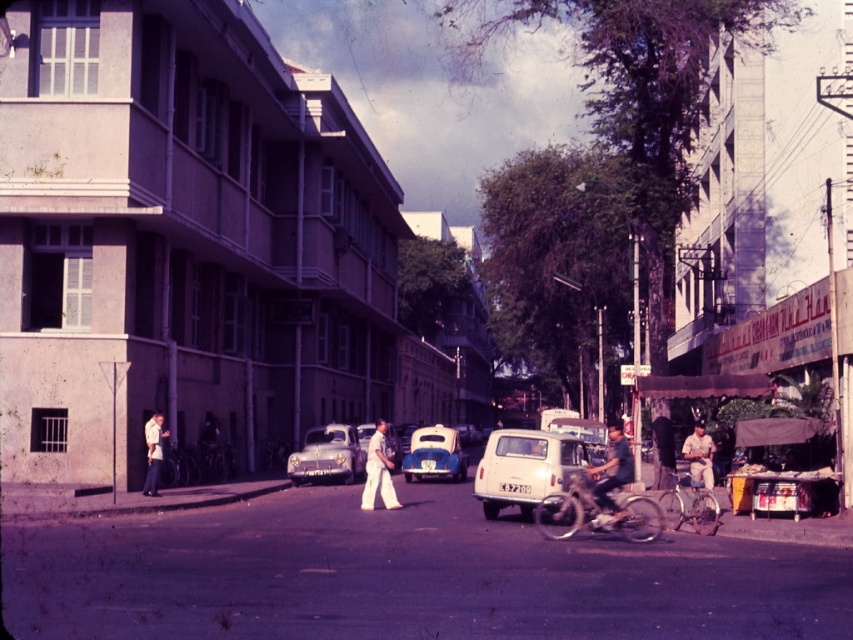
You are a passerby on the street and see both the light brown leather jacket at lower right and the white cotton shirt at left. Which clothing item is positioned to the right side of the other?

The light brown leather jacket at lower right is positioned to the right of the white cotton shirt at left.

You are a delivery person who needs to load a package onto the matte black bicycle at center. The package requires a space that is taller than the white cotton pants at center. Can the package be placed on the bicycle?

The matte black bicycle at center is taller than the white cotton pants at center, so the package can be placed on the bicycle as it meets the height requirement.

You are a delivery person who needs to deliver a package to the light brown leather jacket at lower right. The delivery zone is a circular area with a radius of 0.1 units centered at point A. If the jacket is within this zone, you can drop the package. Is the jacket within the delivery zone?

The light brown leather jacket at lower right is located at point (699,454). To determine if it is within the delivery zone centered at point A with radius 0.1 units, we need to calculate the distance between the jacket and point A. However, the coordinates of point A are not provided in the given information. Without knowing point A, we cannot confirm whether the jacket is within the delivery zone.